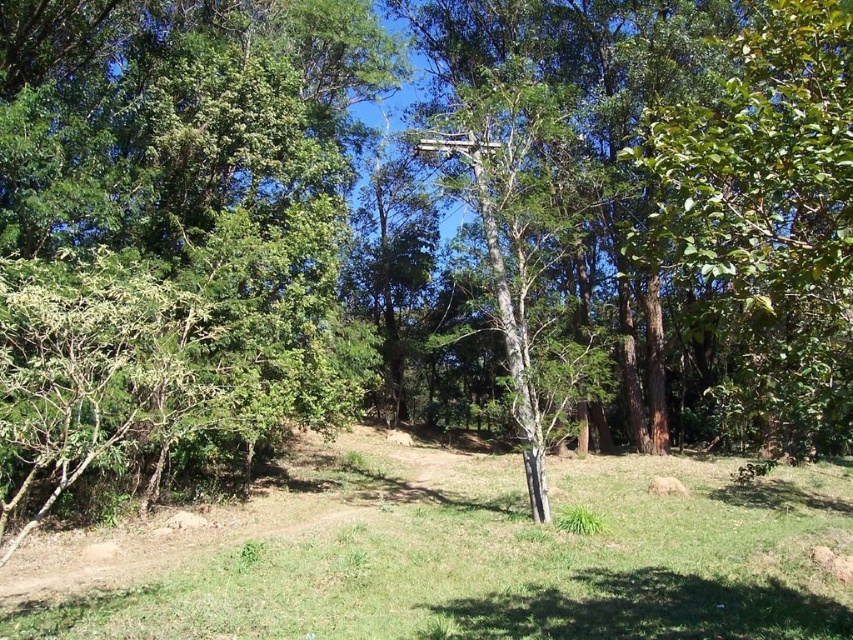
You are a gardener planning to place a new bench in the green grassy area at center. The bench is 1.5 meters wide. Can the green grassy at center accommodate the bench without overlapping the white smooth birch tree at center?

The green grassy at center might be wider than the white smooth birch tree at center, so there is a possibility that the bench can fit without overlapping. However, the exact dimensions are uncertain based on the provided information.